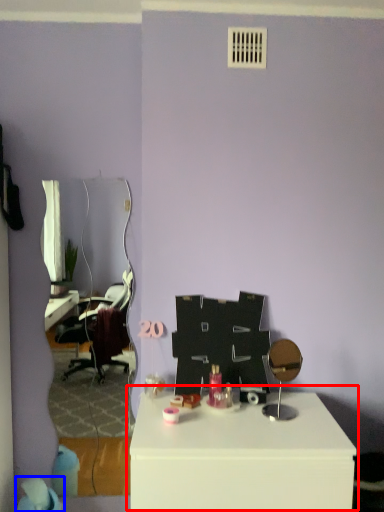
Question: Which point is further to the camera, table (highlighted by a red box) or bean bag chair (highlighted by a blue box)?

Choices:
 (A) table
 (B) bean bag chair

Answer: (B)